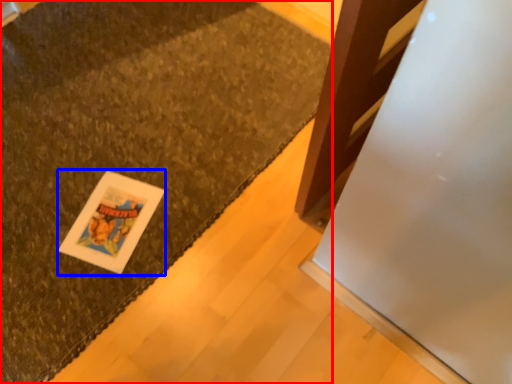
Question: Which object is further to the camera taking this photo, mat (highlighted by a red box) or card (highlighted by a blue box)?

Choices:
 (A) mat
 (B) card

Answer: (B)